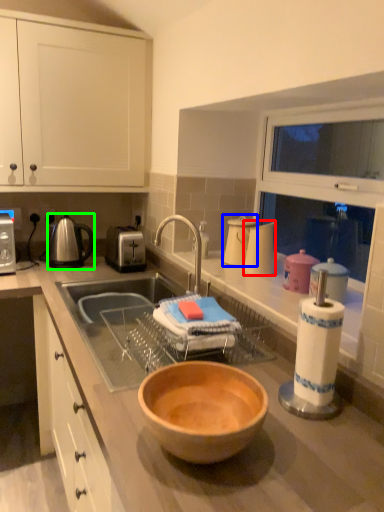
Question: Estimate the real-world distances between objects in this image. Which object is farther from appliance (highlighted by a red box), appliance (highlighted by a blue box) or tea pot (highlighted by a green box)?

Choices:
 (A) appliance
 (B) tea pot

Answer: (B)